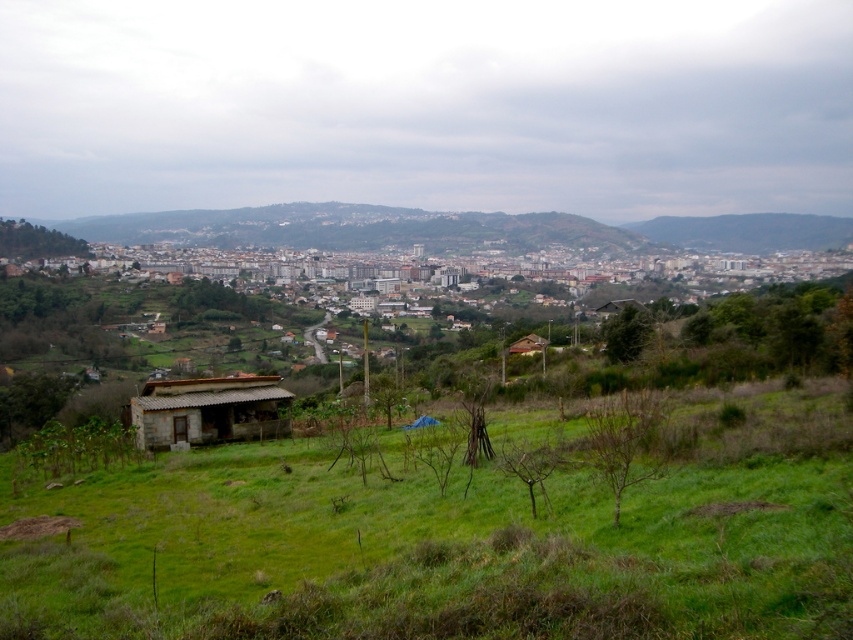
Can you confirm if green grassy field at lower center is thinner than brown wooden hut at center?

No, green grassy field at lower center is not thinner than brown wooden hut at center.

Is green grassy field at lower center shorter than brown wooden hut at center?

Incorrect, green grassy field at lower center's height does not fall short of brown wooden hut at center's.

What do you see at coordinates (428, 550) in the screenshot? I see `green grassy field at lower center` at bounding box center [428, 550].

You are a GUI agent. You are given a task and a screenshot of the screen. Output one action in this format:
    pyautogui.click(x=<x>, y=<y>)
    Task: Click on the green grassy field at lower center
    
    Given the screenshot: What is the action you would take?
    pyautogui.click(x=428, y=550)

Who is more distant from viewer, (438, 625) or (253, 381)?

The point (253, 381) is behind.

Identify the location of green grassy field at lower center. Image resolution: width=853 pixels, height=640 pixels. (428, 550).

Is rustic stone hut at lower left wider than brown wooden hut at center?

Indeed, rustic stone hut at lower left has a greater width compared to brown wooden hut at center.

Can you confirm if rustic stone hut at lower left is positioned to the right of brown wooden hut at center?

No, rustic stone hut at lower left is not to the right of brown wooden hut at center.

Find the location of `rustic stone hut at lower left`. rustic stone hut at lower left is located at coordinates [207, 410].

You are a GUI agent. You are given a task and a screenshot of the screen. Output one action in this format:
    pyautogui.click(x=<x>, y=<y>)
    Task: Click on the rustic stone hut at lower left
    
    Given the screenshot: What is the action you would take?
    pyautogui.click(x=207, y=410)